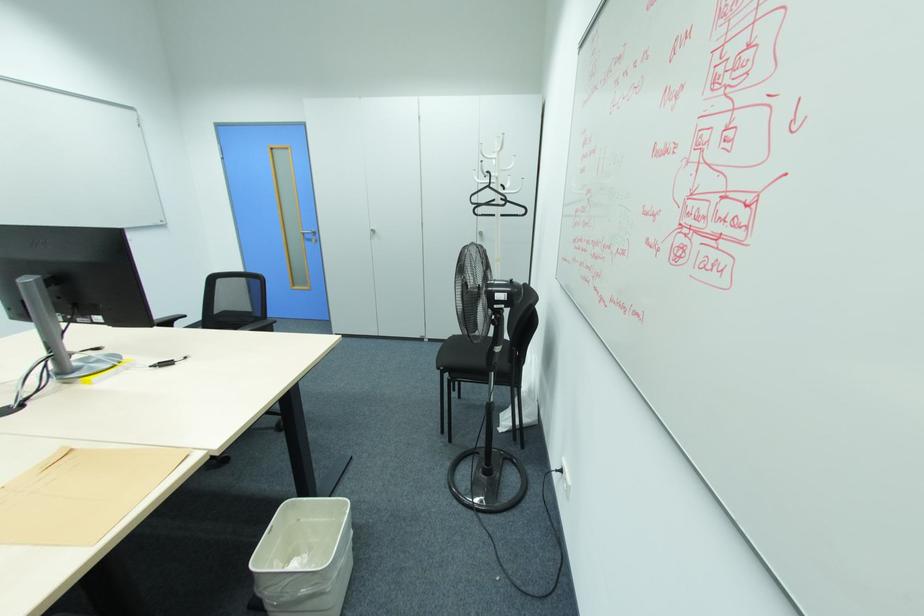
Find where to sit the chair sitting surface. Please return your answer as a coordinate pair (x, y).

(468, 355)